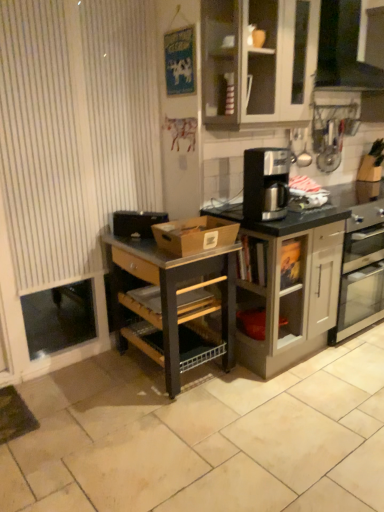
Question: From the image's perspective, is brown cardboard box at center above or below metallic black shelf at center?

Choices:
 (A) above
 (B) below

Answer: (A)

Question: Considering the positions of brown cardboard box at center and metallic black shelf at center in the image, is brown cardboard box at center bigger or smaller than metallic black shelf at center?

Choices:
 (A) small
 (B) big

Answer: (A)

Question: Which is nearer to the matte glass cabinet at upper center, arranged as the 2th cabinetry when ordered from the bottom?

Choices:
 (A) beige tile at lower center
 (B) black matte toaster at left
 (C) white striped curtain at left
 (D) metallic black shelf at center
 (E) brown cardboard box at center

Answer: (C)

Question: Which of these objects is positioned farthest from the black granite coffee maker at center?

Choices:
 (A) black plastic coffee maker at center
 (B) beige tile at lower center
 (C) matte gray cabinet at center, the 1th cabinetry positioned from the bottom
 (D) metallic black shelf at center
 (E) black glossy vent at upper right

Answer: (B)